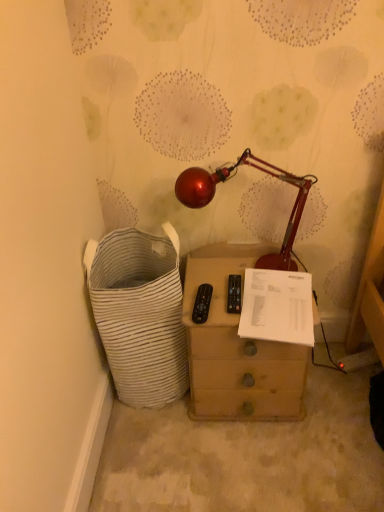
Question: Is shiny metallic lamp at center to the left or to the right of wooden chest of drawers at center in the image?

Choices:
 (A) left
 (B) right

Answer: (A)

Question: Considering the positions of shiny metallic lamp at center and wooden chest of drawers at center in the image, is shiny metallic lamp at center bigger or smaller than wooden chest of drawers at center?

Choices:
 (A) small
 (B) big

Answer: (A)

Question: Considering the real-world distances, which object is closest to the white striped fabric laundry basket at left?

Choices:
 (A) wooden chest of drawers at center
 (B) shiny metallic lamp at center
 (C) white paper at center

Answer: (A)

Question: Which is nearer to the white striped fabric laundry basket at left?

Choices:
 (A) wooden chest of drawers at center
 (B) shiny metallic lamp at center
 (C) white paper at center

Answer: (A)